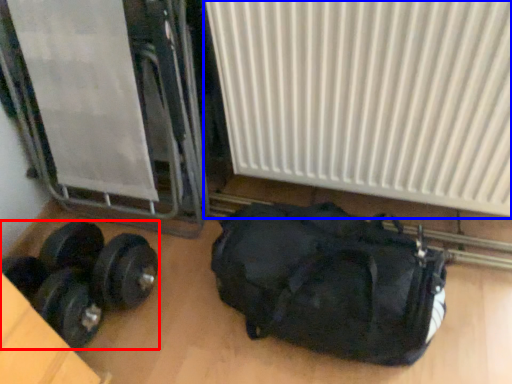
Question: Which of the following is the farthest to the observer, dumbbell (highlighted by a red box) or radiator (highlighted by a blue box)?

Choices:
 (A) dumbbell
 (B) radiator

Answer: (A)